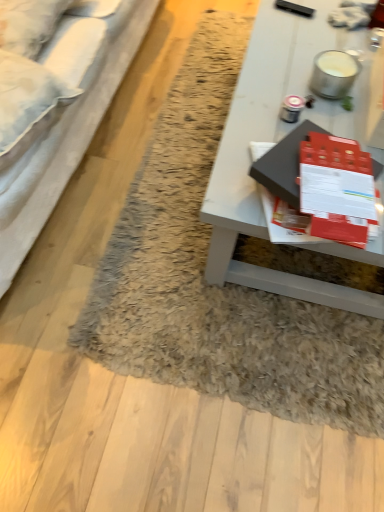
Question: Considering the positions of white fabric studio couch at left and matte black book at center in the image, is white fabric studio couch at left taller or shorter than matte black book at center?

Choices:
 (A) tall
 (B) short

Answer: (A)

Question: Is point (1, 229) closer or farther from the camera than point (372, 164)?

Choices:
 (A) closer
 (B) farther

Answer: (B)

Question: Based on their relative distances, which object is farther from the matte black book at center?

Choices:
 (A) fuzzy rug at center
 (B) white fabric pillow at upper left
 (C) white fabric studio couch at left
 (D) white glossy table at center

Answer: (B)

Question: Which object is positioned closest to the white glossy table at center?

Choices:
 (A) white fabric studio couch at left
 (B) matte black book at center
 (C) fuzzy rug at center
 (D) white fabric pillow at upper left

Answer: (B)